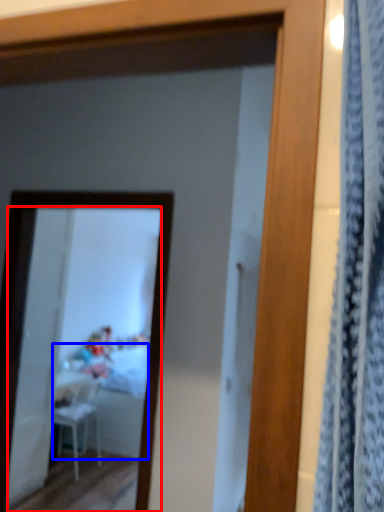
Question: Which of the following is the farthest to the observer, mirror (highlighted by a red box) or table (highlighted by a blue box)?

Choices:
 (A) mirror
 (B) table

Answer: (B)